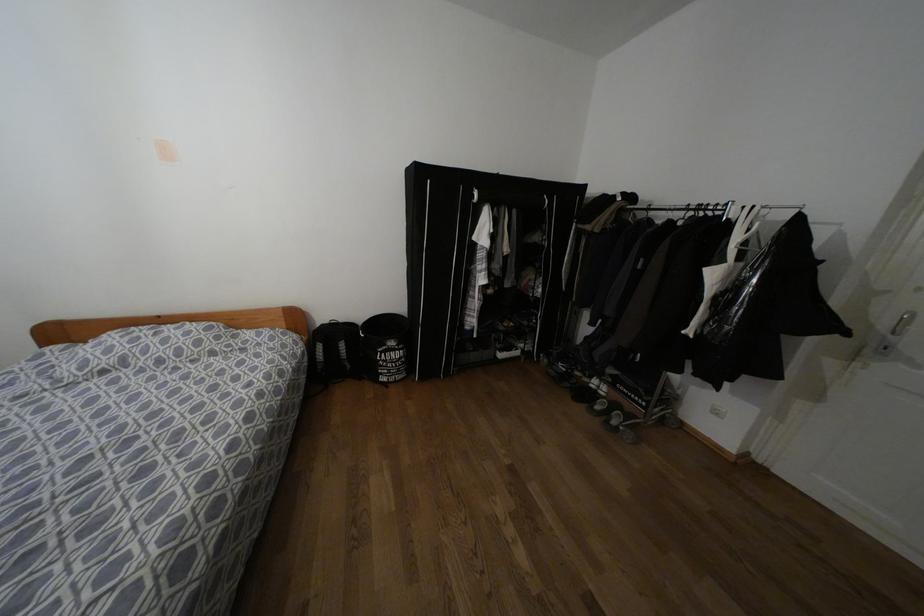
Where is `black laundry basket`? This screenshot has width=924, height=616. black laundry basket is located at coordinates (383, 347).